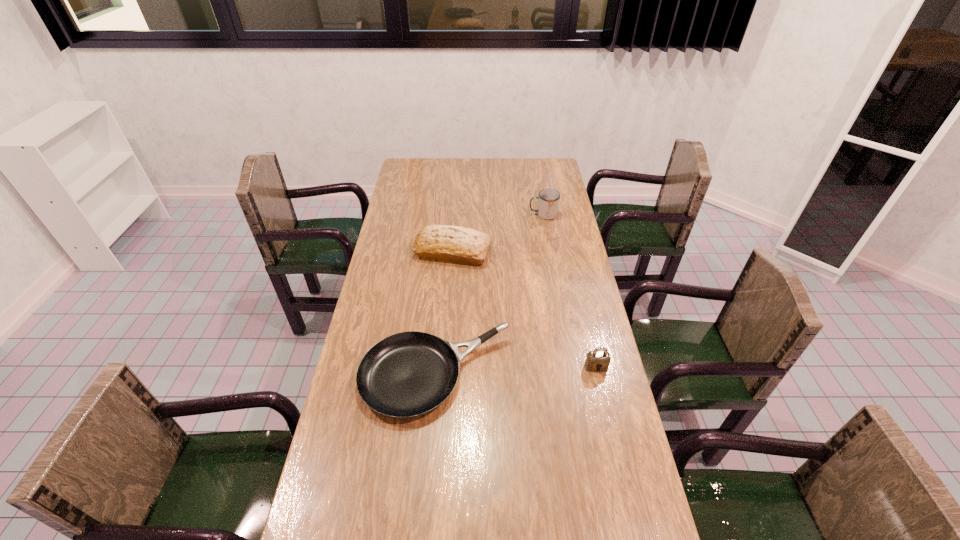
Identify which object is the closest to the pan. Please provide its 2D coordinates. Your answer should be formatted as a tuple, i.e. [(x, y)], where the tuple contains the x and y coordinates of a point satisfying the conditions above.

[(598, 360)]